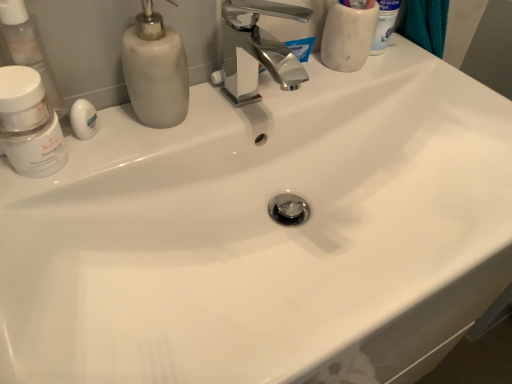
You are a GUI agent. You are given a task and a screenshot of the screen. Output one action in this format:
    pyautogui.click(x=<x>, y=<y>)
    Task: Click on the free space in front of white matte soap at left
    The image size is (512, 384).
    Given the screenshot: What is the action you would take?
    pyautogui.click(x=53, y=220)